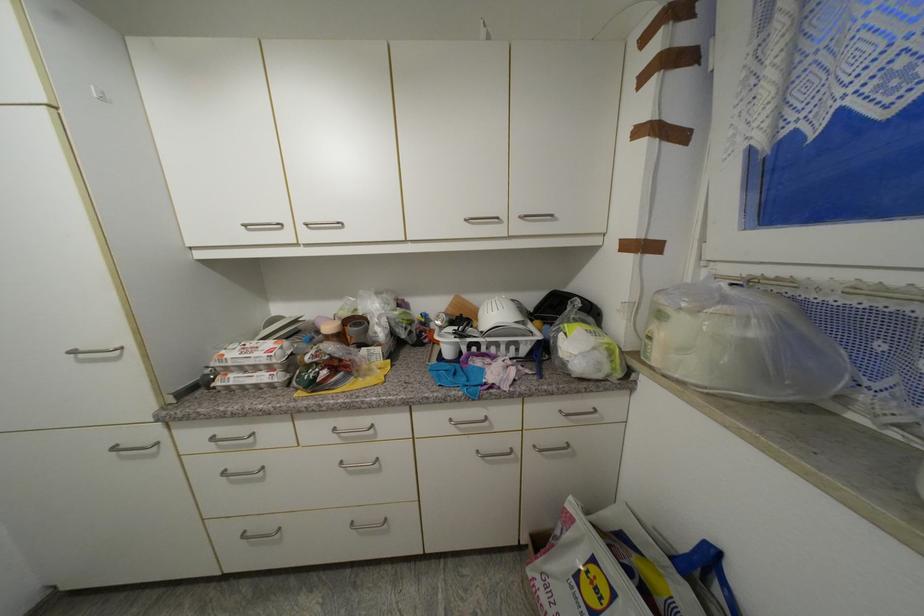
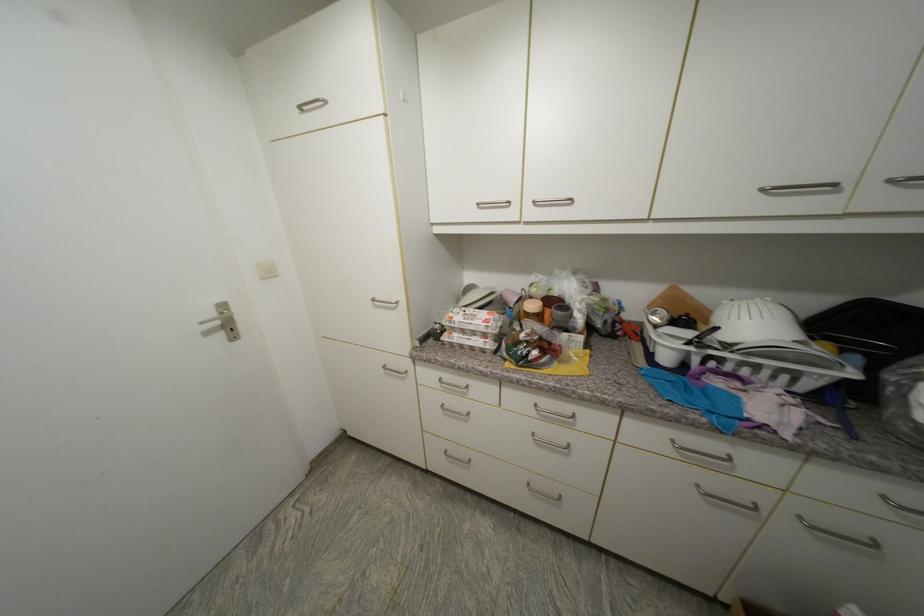
In the second image, find the point that corresponds to pixel 312 227 in the first image.

(540, 204)